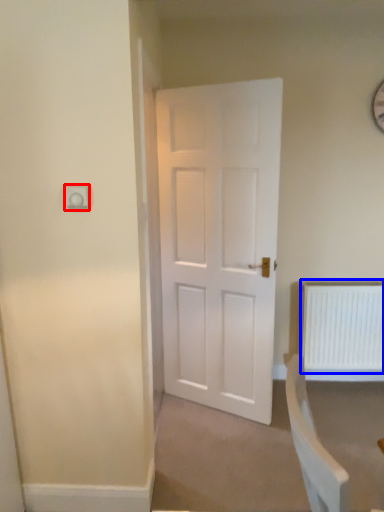
Question: Which point is closer to the camera, electric outlet (highlighted by a red box) or radiator (highlighted by a blue box)?

Choices:
 (A) electric outlet
 (B) radiator

Answer: (A)